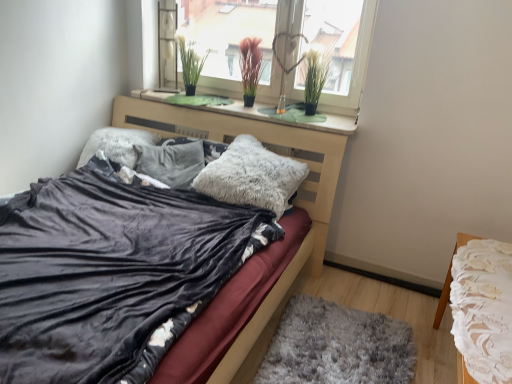
Describe the element at coordinates (270, 149) in the screenshot. I see `velvet black bed at center` at that location.

The image size is (512, 384). I want to click on fuzzy gray pillow at center, which is counted as the third pillow, starting from the left, so click(x=251, y=176).

At what (x,y) coordinates should I click in order to perform the action: click on green grass-like plant at upper center, which is the first plant in left-to-right order. Please return your answer as a coordinate pair (x, y). Looking at the image, I should click on (191, 60).

In order to face green felt at upper center, should I rotate leftwards or rightwards?

Turn left by 1.558 degrees to look at green felt at upper center.

Find the location of a particular element. Image resolution: width=512 pixels, height=384 pixels. green felt at upper center is located at coordinates (286, 120).

Where is `purple matte plant at center, which is the second plant in left-to-right order`? The width and height of the screenshot is (512, 384). purple matte plant at center, which is the second plant in left-to-right order is located at coordinates (250, 68).

From a real-world perspective, which object stands above the other?

green grass-like plant at upper center, which is the first plant in left-to-right order, from a real-world perspective.

Considering the sizes of objects green grass-like plant at upper center, acting as the 3th plant starting from the right, and green felt at upper center in the image provided, who is bigger, green grass-like plant at upper center, acting as the 3th plant starting from the right, or green felt at upper center?

With larger size is green felt at upper center.

How much distance is there between green grass-like plant at upper center, acting as the 3th plant starting from the right, and green felt at upper center?

The distance of green grass-like plant at upper center, acting as the 3th plant starting from the right, from green felt at upper center is 22.61 inches.

Between point (186, 36) and point (347, 125), which one is positioned in front?

Point (347, 125)

Is green grass-like plant at upper center, positioned as the 1th plant in right-to-left order, closer to the viewer compared to fuzzy gray pillow at center, positioned as the third pillow in right-to-left order?

Yes, the depth of green grass-like plant at upper center, positioned as the 1th plant in right-to-left order, is less than that of fuzzy gray pillow at center, positioned as the third pillow in right-to-left order.

Consider the image. From a real-world perspective, is green grass-like plant at upper center, positioned as the 1th plant in right-to-left order, on fuzzy gray pillow at center, the 1th pillow viewed from the left?

Correct, in the physical world, green grass-like plant at upper center, positioned as the 1th plant in right-to-left order, is higher than fuzzy gray pillow at center, the 1th pillow viewed from the left.

Is green grass-like plant at upper center, positioned as the 1th plant in right-to-left order, aimed at fuzzy gray pillow at center, positioned as the third pillow in right-to-left order?

No, green grass-like plant at upper center, positioned as the 1th plant in right-to-left order, does not turn towards fuzzy gray pillow at center, positioned as the third pillow in right-to-left order.

From the picture: Is green felt at upper center in front of or behind white lace tablecloth at right in the image?

green felt at upper center is positioned farther from the viewer than white lace tablecloth at right.

Is point (244, 113) closer or farther from the camera than point (461, 362)?

Point (244, 113) appears to be farther away from the viewer than point (461, 362).

Which is more to the right, green felt at upper center or white lace tablecloth at right?

white lace tablecloth at right is more to the right.

Can purple matte plant at center, which is the second plant in left-to-right order, be found inside green felt at upper center?

No, purple matte plant at center, which is the second plant in left-to-right order, is not surrounded by green felt at upper center.

Is green felt at upper center facing away from purple matte plant at center, positioned as the second plant in right-to-left order?

That's not correct — green felt at upper center is not looking away from purple matte plant at center, positioned as the second plant in right-to-left order.

Where is `the 2nd plant behind the green felt at upper center`? the 2nd plant behind the green felt at upper center is located at coordinates (250, 68).

How different are the orientations of green felt at upper center and purple matte plant at center, which is the second plant in left-to-right order, in degrees?

There is a 1.62-degree angle between the facing directions of green felt at upper center and purple matte plant at center, which is the second plant in left-to-right order.

Looking at this image, from a real-world perspective, is transparent glass window at upper center below fuzzy gray pillow at center, positioned as the third pillow in right-to-left order?

No, from a real-world perspective, transparent glass window at upper center is not below fuzzy gray pillow at center, positioned as the third pillow in right-to-left order.

In the scene shown: Considering the relative sizes of transparent glass window at upper center and fuzzy gray pillow at center, the 1th pillow viewed from the left, in the image provided, is transparent glass window at upper center smaller than fuzzy gray pillow at center, the 1th pillow viewed from the left,?

Incorrect, transparent glass window at upper center is not smaller in size than fuzzy gray pillow at center, the 1th pillow viewed from the left.

Is transparent glass window at upper center not inside fuzzy gray pillow at center, positioned as the third pillow in right-to-left order?

Yes, transparent glass window at upper center is not within fuzzy gray pillow at center, positioned as the third pillow in right-to-left order.

Is transparent glass window at upper center positioned with its back to fuzzy gray pillow at center, the 1th pillow viewed from the left?

No, transparent glass window at upper center's orientation is not away from fuzzy gray pillow at center, the 1th pillow viewed from the left.

Is fuzzy gray pillow at center, which is counted as the third pillow, starting from the left, facing away from fuzzy white pillow at center, the second pillow viewed from the right?

No, fuzzy white pillow at center, the second pillow viewed from the right, is not at the back of fuzzy gray pillow at center, which is counted as the third pillow, starting from the left.

From a real-world perspective, does fuzzy gray pillow at center, which is counted as the third pillow, starting from the left, stand above fuzzy white pillow at center, which ranks as the 2th pillow in left-to-right order?

Yes.

The image size is (512, 384). Identify the location of pillow lying in front of the fuzzy white pillow at center, the second pillow viewed from the right. tap(251, 176).

Looking at this image, can you confirm if fuzzy gray pillow at center, which is counted as the third pillow, starting from the left, is positioned to the left of fuzzy white pillow at center, which ranks as the 2th pillow in left-to-right order?

In fact, fuzzy gray pillow at center, which is counted as the third pillow, starting from the left, is to the right of fuzzy white pillow at center, which ranks as the 2th pillow in left-to-right order.

Considering the relative sizes of fuzzy gray pillow at center, which is counted as the third pillow, starting from the left, and gray shaggy rug at lower center in the image provided, is fuzzy gray pillow at center, which is counted as the third pillow, starting from the left, thinner than gray shaggy rug at lower center?

Indeed, fuzzy gray pillow at center, which is counted as the third pillow, starting from the left, has a lesser width compared to gray shaggy rug at lower center.

From a real-world perspective, is fuzzy gray pillow at center, which ranks as the 1th pillow in right-to-left order, over gray shaggy rug at lower center?

Yes.

Could you tell me if fuzzy gray pillow at center, which ranks as the 1th pillow in right-to-left order, is turned towards gray shaggy rug at lower center?

No, fuzzy gray pillow at center, which ranks as the 1th pillow in right-to-left order, is not turned towards gray shaggy rug at lower center.

This screenshot has height=384, width=512. In order to click on plant that is the 3rd one when counting upward from the green felt at upper center (from the image's perspective) in this screenshot , I will do `click(191, 60)`.

You are a GUI agent. You are given a task and a screenshot of the screen. Output one action in this format:
    pyautogui.click(x=<x>, y=<y>)
    Task: Click on the pillow behind the green grass-like plant at upper center, positioned as the 1th plant in right-to-left order
    The image size is (512, 384).
    Given the screenshot: What is the action you would take?
    pyautogui.click(x=117, y=145)

Based on the photo, looking at the image, which one is located further to green grass-like plant at upper center, positioned as the 1th plant in right-to-left order, fuzzy white pillow at center, the second pillow viewed from the right, or velvet black bed at center?

fuzzy white pillow at center, the second pillow viewed from the right.

Considering their positions, is fuzzy gray pillow at center, which is counted as the third pillow, starting from the left, positioned further to purple matte plant at center, positioned as the second plant in right-to-left order, than green grass-like plant at upper center, which is the first plant in left-to-right order?

fuzzy gray pillow at center, which is counted as the third pillow, starting from the left, lies further to purple matte plant at center, positioned as the second plant in right-to-left order, than the other object.

Based on their spatial positions, is fuzzy gray pillow at center, which ranks as the 1th pillow in right-to-left order, or fuzzy white pillow at center, the second pillow viewed from the right, closer to green felt at upper center?

The object closer to green felt at upper center is fuzzy gray pillow at center, which ranks as the 1th pillow in right-to-left order.

Based on their spatial positions, is gray shaggy rug at lower center or transparent glass window at upper center closer to green grass-like plant at upper center, which is the first plant in left-to-right order?

Among the two, transparent glass window at upper center is located nearer to green grass-like plant at upper center, which is the first plant in left-to-right order.

Considering their positions, is transparent glass window at upper center positioned further to gray shaggy rug at lower center than velvet black bed at center?

Based on the image, transparent glass window at upper center appears to be further to gray shaggy rug at lower center.

Looking at the image, which one is located further to purple matte plant at center, positioned as the second plant in right-to-left order, green felt at upper center or fuzzy gray pillow at center, positioned as the third pillow in right-to-left order?

fuzzy gray pillow at center, positioned as the third pillow in right-to-left order, is further to purple matte plant at center, positioned as the second plant in right-to-left order.

From the image, which object appears to be nearer to transparent glass window at upper center, velvet black bed at center or green grass-like plant at upper center, which is the first plant in left-to-right order?

Among the two, green grass-like plant at upper center, which is the first plant in left-to-right order, is located nearer to transparent glass window at upper center.

When comparing their distances from velvet black bed at center, does purple matte plant at center, positioned as the second plant in right-to-left order, or green felt at upper center seem closer?

green felt at upper center lies closer to velvet black bed at center than the other object.

Identify the location of pillow located between fuzzy white pillow at center, which ranks as the 2th pillow in left-to-right order, and green grass-like plant at upper center, positioned as the 1th plant in right-to-left order, in the left-right direction. The width and height of the screenshot is (512, 384). (251, 176).

This screenshot has height=384, width=512. What are the coordinates of `nightstand between velvet black bed at center and green grass-like plant at upper center, which is the first plant in left-to-right order, from front to back` in the screenshot? It's located at (443, 298).

The width and height of the screenshot is (512, 384). Find the location of `window sill that lies between purple matte plant at center, which is the second plant in left-to-right order, and fuzzy gray pillow at center, which is counted as the third pillow, starting from the left, from top to bottom`. window sill that lies between purple matte plant at center, which is the second plant in left-to-right order, and fuzzy gray pillow at center, which is counted as the third pillow, starting from the left, from top to bottom is located at coordinates (286, 120).

Identify the location of window situated between fuzzy white pillow at center, the second pillow viewed from the right, and green grass-like plant at upper center, positioned as the 1th plant in right-to-left order, from left to right. This screenshot has height=384, width=512. (282, 46).